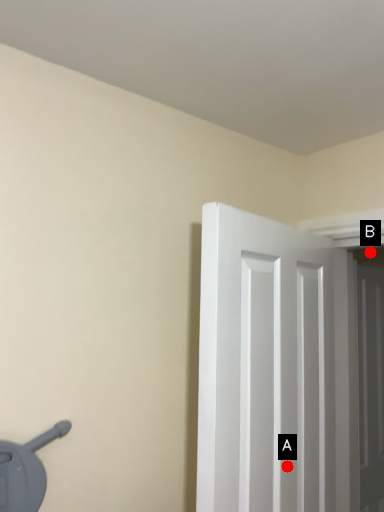
Question: Two points are circled on the image, labeled by A and B beside each circle. Which of the following is the farthest from the observer?

Choices:
 (A) A is further
 (B) B is further

Answer: (B)